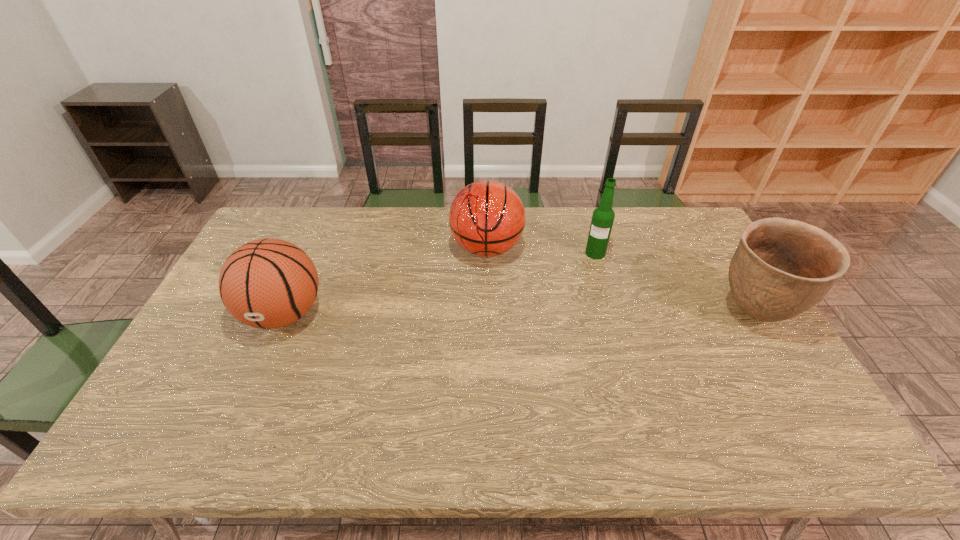
At what (x,y) coordinates should I click in order to perform the action: click on vacant space on the desktop that is between the leftmost object and the rightmost object and is positioned on the label of the second object from right to left. Please return your answer as a coordinate pair (x, y). The image size is (960, 540). Looking at the image, I should click on (583, 314).

At what (x,y) coordinates should I click in order to perform the action: click on vacant spot on the desktop that is between the leftmost object and the rightmost object and is positioned on the side with spill of the second object from left to right. Please return your answer as a coordinate pair (x, y). Looking at the image, I should click on point(468,314).